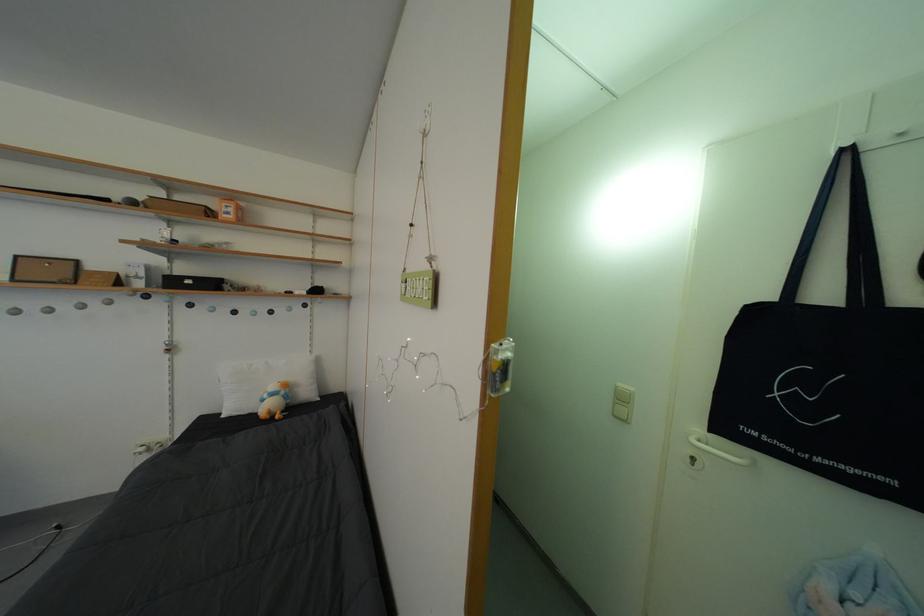
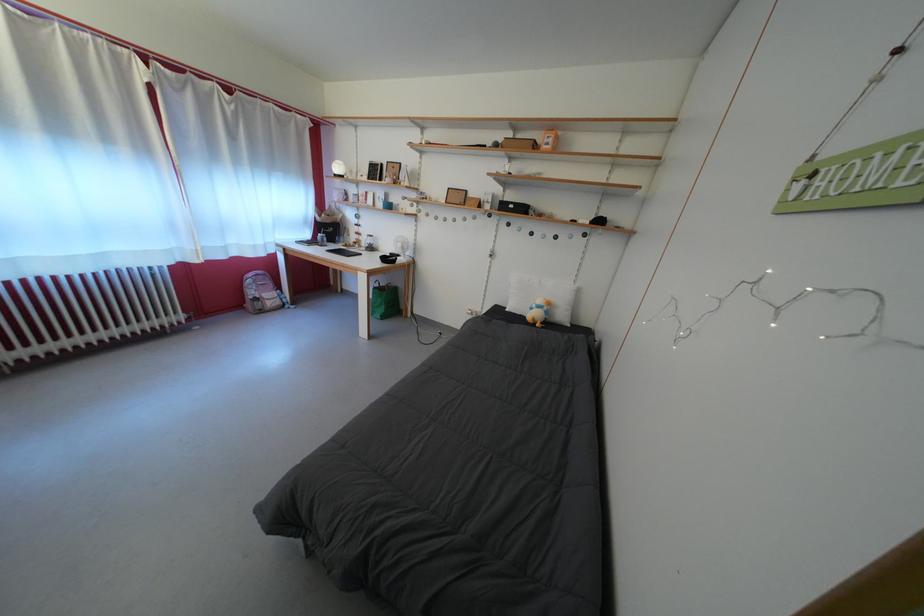
In the second image, find the point that corresponds to the point at 295,403 in the first image.

(554, 318)